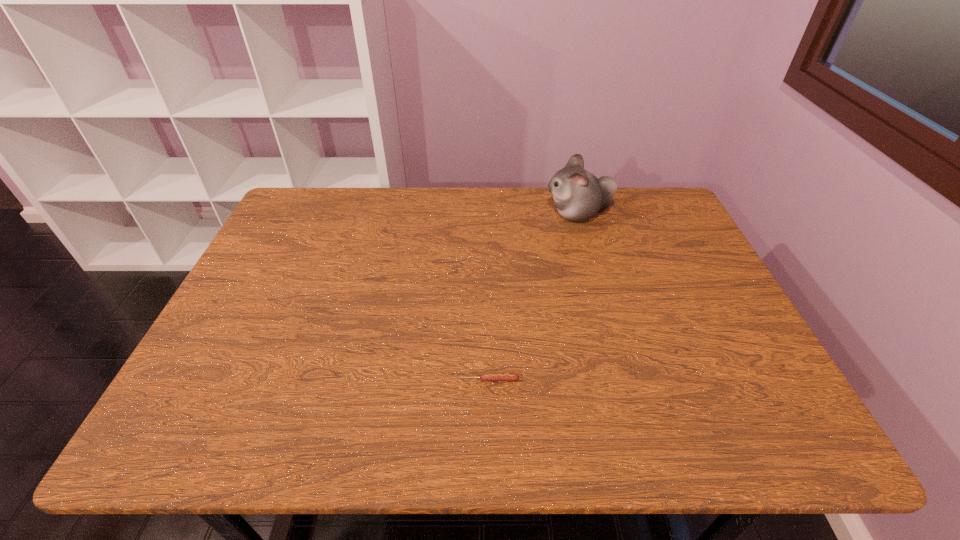
The image size is (960, 540). What are the coordinates of `vacant space at the near edge of the desktop` in the screenshot? It's located at (513, 426).

This screenshot has width=960, height=540. I want to click on vacant region at the left edge of the desktop, so click(262, 253).

Locate an element on the screen. The height and width of the screenshot is (540, 960). vacant region at the right edge of the desktop is located at coordinates (650, 255).

In the image, there is a desktop. At what (x,y) coordinates should I click in order to perform the action: click on free space at the far left corner. Please return your answer as a coordinate pair (x, y). The width and height of the screenshot is (960, 540). Looking at the image, I should click on (306, 213).

At what (x,y) coordinates should I click in order to perform the action: click on vacant space at the near left corner of the desktop. Please return your answer as a coordinate pair (x, y). This screenshot has width=960, height=540. Looking at the image, I should click on (170, 429).

This screenshot has height=540, width=960. In order to click on vacant space at the far right corner of the desktop in this screenshot , I will do `click(663, 211)`.

In order to click on blank area at the near right corner in this screenshot , I will do `click(741, 448)`.

Where is `vacant space that satisfies the following two spatial constraints: 1. on the face of the taller object; 2. on the front side of the sausage`? vacant space that satisfies the following two spatial constraints: 1. on the face of the taller object; 2. on the front side of the sausage is located at coordinates (624, 380).

This screenshot has width=960, height=540. I want to click on blank area in the image that satisfies the following two spatial constraints: 1. on the face of the right object; 2. on the front side of the left object, so click(624, 380).

The height and width of the screenshot is (540, 960). Find the location of `free region that satisfies the following two spatial constraints: 1. on the face of the right object; 2. on the front side of the left object`. free region that satisfies the following two spatial constraints: 1. on the face of the right object; 2. on the front side of the left object is located at coordinates (624, 380).